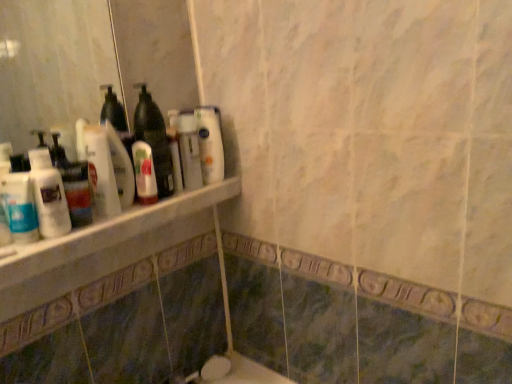
Find the location of a particular element. vacant area that lies to the right of translucent plastic bottle at left, the third cleaning product when ordered from back to front is located at coordinates (111, 224).